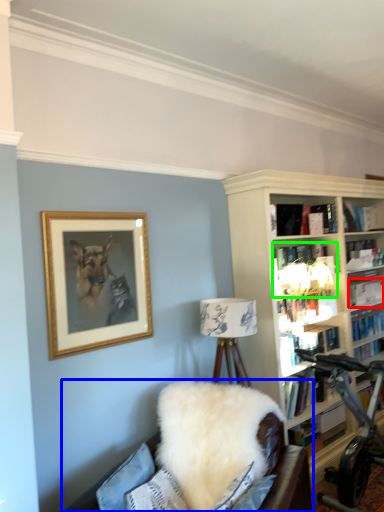
Question: Which is farther away from book (highlighted by a red box)? studio couch (highlighted by a blue box) or book (highlighted by a green box)?

Choices:
 (A) studio couch
 (B) book

Answer: (A)